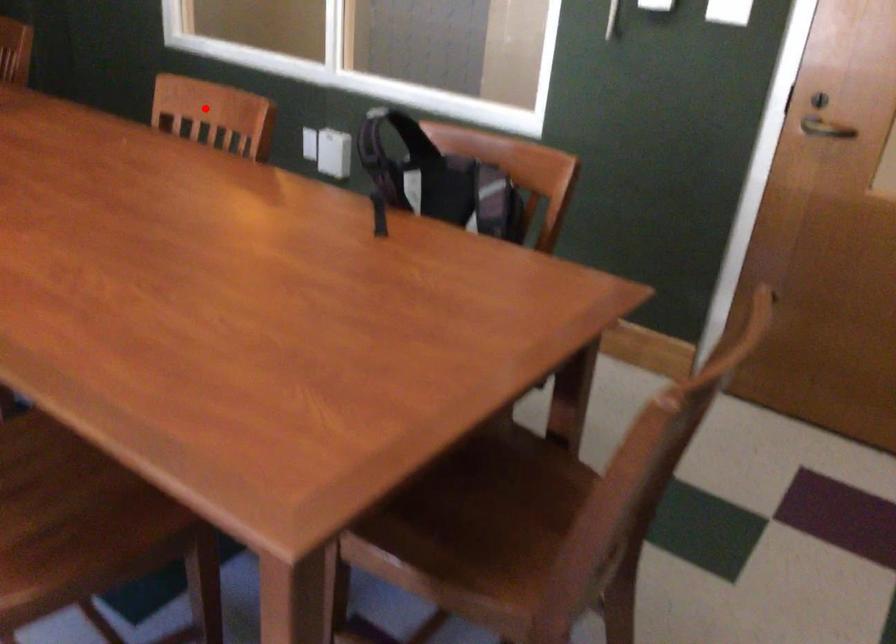
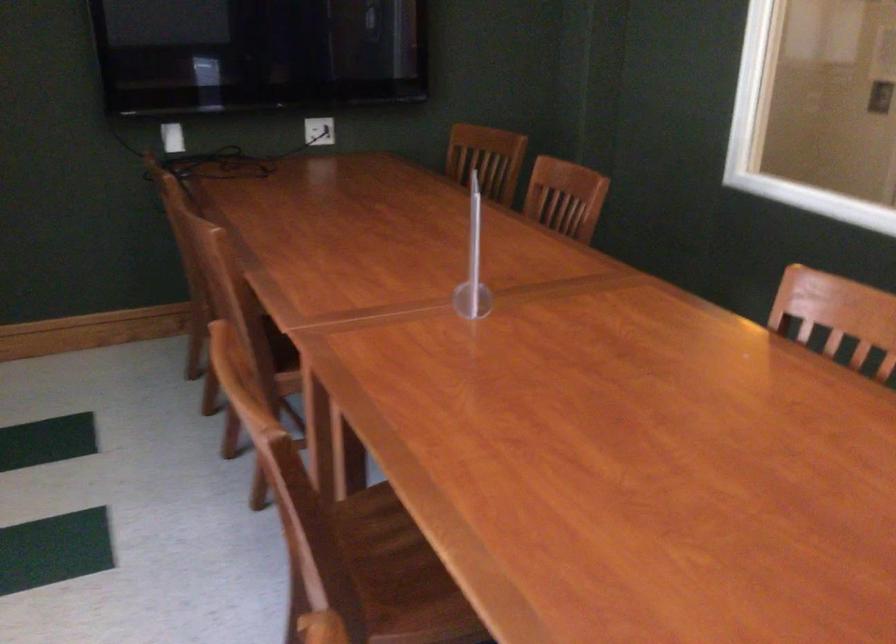
Question: I am providing you with two images of the same scene from different viewpoints. Image1 has a red point marked. In image2, the corresponding 3D location appears at what relative position? Reply with the corresponding letter.

Choices:
 (A) Closer
 (B) Farther

Answer: (A)